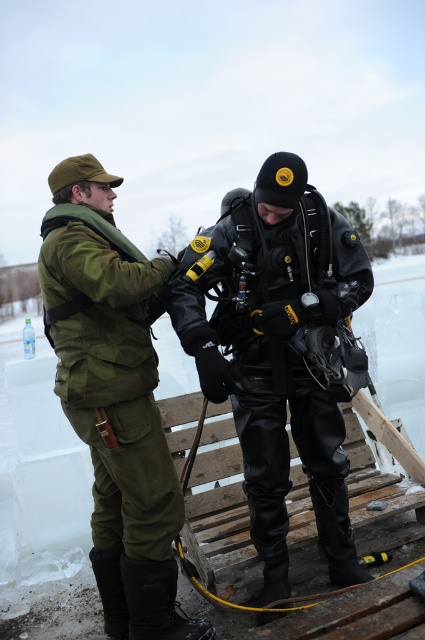
You are an observer standing in front of the two people in the image. Which object is positioned higher up between the black leather diving suit at center and the green matte uniform at left?

The black leather diving suit at center is positioned higher up than the green matte uniform at left according to the description.

You are an observer standing at the edge of the frozen lake. You notice two people preparing for ice diving. The black leather diving suit at center and the green matte uniform at left are visible. Which of these two items is shorter in height?

The black leather diving suit at center has a lesser height compared to the green matte uniform at left, so the black leather diving suit at center is shorter in height.

You are organizing a gear storage room and need to place the black leather diving suit at center and the green matte uniform at left. Given their sizes, which one requires more storage space?

The black leather diving suit at center requires more storage space because it is bigger than the green matte uniform at left.